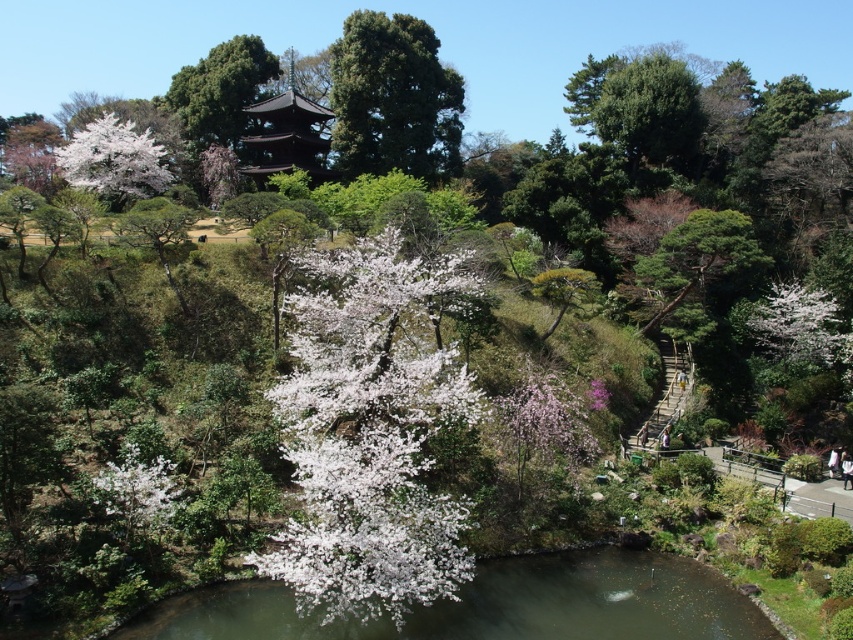
At what (x,y) coordinates should I click in order to perform the action: click on white matte flower at center. Please return your answer as a coordinate pair (x, y). The image size is (853, 640). Looking at the image, I should click on (370, 433).

Can you confirm if white matte flower at center is bigger than green textured tree at upper center?

No, white matte flower at center is not bigger than green textured tree at upper center.

The image size is (853, 640). Identify the location of white matte flower at center. (370, 433).

At what (x,y) coordinates should I click in order to perform the action: click on white matte flower at center. Please return your answer as a coordinate pair (x, y). Looking at the image, I should click on (370, 433).

Does green textured tree at upper center have a lesser height compared to pink silky blossoms at center?

No, green textured tree at upper center is not shorter than pink silky blossoms at center.

Is green textured tree at upper center thinner than pink silky blossoms at center?

In fact, green textured tree at upper center might be wider than pink silky blossoms at center.

Is point (363, 140) more distant than point (508, 426)?

Yes.

You are a GUI agent. You are given a task and a screenshot of the screen. Output one action in this format:
    pyautogui.click(x=<x>, y=<y>)
    Task: Click on the green textured tree at upper center
    This screenshot has height=640, width=853.
    Given the screenshot: What is the action you would take?
    pyautogui.click(x=393, y=99)

Can you confirm if green textured tree at upper center is wider than white fluffy blossoms at lower left?

Yes.

Is green textured tree at upper center positioned in front of white fluffy blossoms at lower left?

→ No, it is behind white fluffy blossoms at lower left.

Describe the element at coordinates (393, 99) in the screenshot. I see `green textured tree at upper center` at that location.

Where is `green textured tree at upper center`? The width and height of the screenshot is (853, 640). green textured tree at upper center is located at coordinates (393, 99).